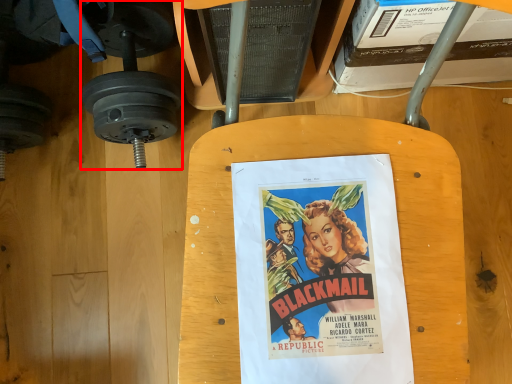
Question: In this image, where is dumbbell (annotated by the red box) located relative to poster?

Choices:
 (A) left
 (B) right

Answer: (A)